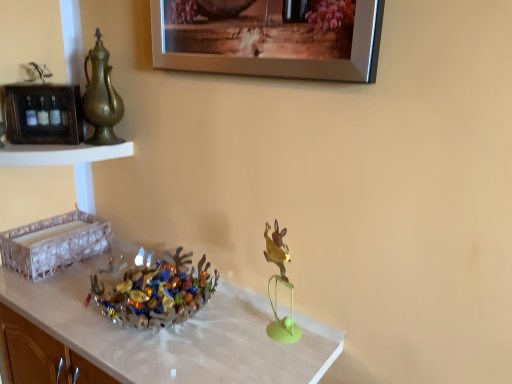
I want to click on unoccupied region to the right of translucent glass tray at left, which is the 2th shelf from top to bottom, so click(105, 262).